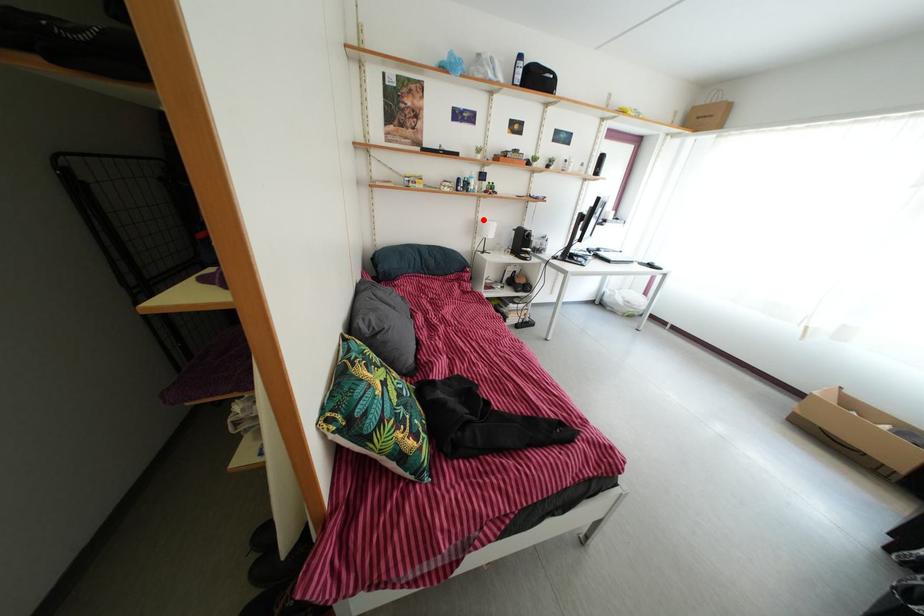
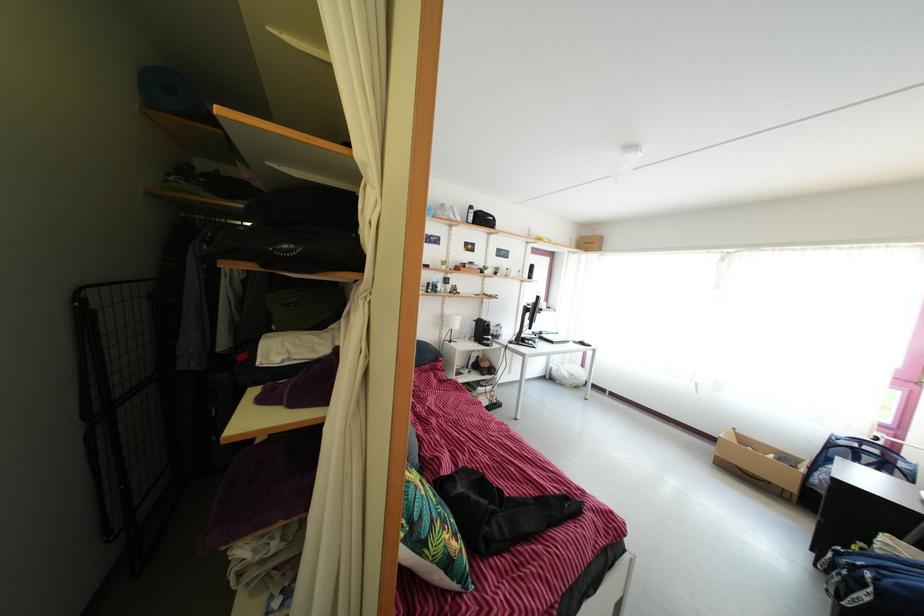
Where in the second image is the point corresponding to the highlighted location from the first image?

(448, 315)